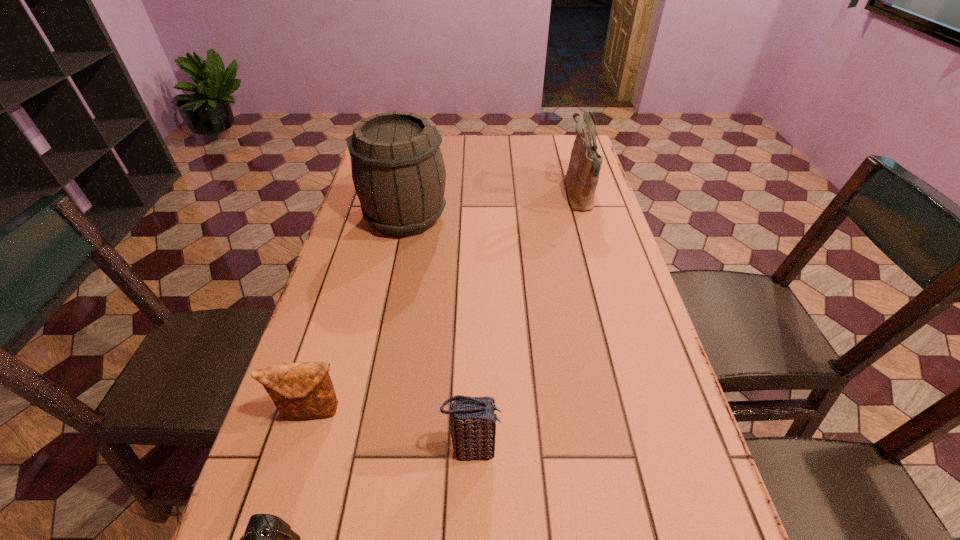
At what (x,y) coordinates should I click in order to perform the action: click on blank region between the second object from right to left and the third farthest object. Please return your answer as a coordinate pair (x, y). Image resolution: width=960 pixels, height=540 pixels. Looking at the image, I should click on (393, 430).

I want to click on free space that is in between the wine bucket and the farthest clutch bag, so click(x=359, y=314).

Where is `free space between the rightmost object and the third nearest object`? The image size is (960, 540). free space between the rightmost object and the third nearest object is located at coordinates point(445,303).

You are a GUI agent. You are given a task and a screenshot of the screen. Output one action in this format:
    pyautogui.click(x=<x>, y=<y>)
    Task: Click on the free point between the rightmost object and the farthest clutch bag
    This screenshot has width=960, height=540.
    Given the screenshot: What is the action you would take?
    pyautogui.click(x=445, y=303)

Where is `object that stands as the third closest to the wine bucket`? This screenshot has height=540, width=960. object that stands as the third closest to the wine bucket is located at coordinates (472, 419).

This screenshot has width=960, height=540. In order to click on object that is the second closest to the wine bucket in this screenshot , I will do `click(304, 390)`.

Image resolution: width=960 pixels, height=540 pixels. Find the location of `the closest clutch bag relative to the wine bucket`. the closest clutch bag relative to the wine bucket is located at coordinates click(304, 390).

This screenshot has width=960, height=540. Identify the location of clutch bag that is the second nearest to the third farthest object. (472, 419).

The height and width of the screenshot is (540, 960). What are the coordinates of `vacant area that satisfies the following two spatial constraints: 1. on the front-facing side of the rightmost object; 2. on the open side of the farthest clutch bag` in the screenshot? It's located at (641, 411).